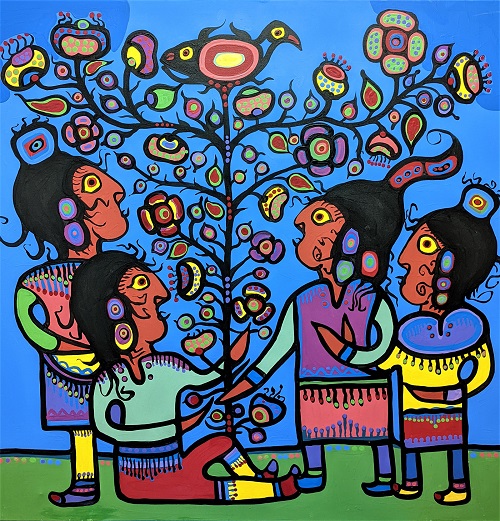
I want to click on lower left corner of artwork, so click(x=499, y=519).